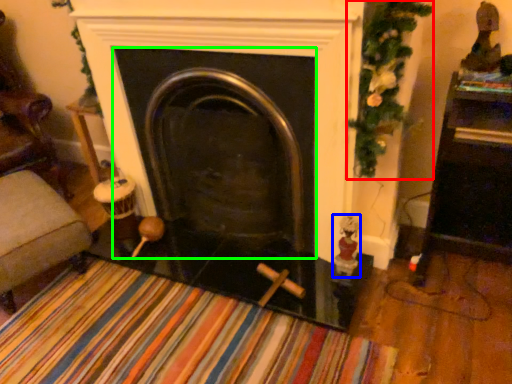
Question: Which object is positioned farthest from christmas decoration (highlighted by a red box)? Select from toy (highlighted by a blue box) and fireplace (highlighted by a green box).

Choices:
 (A) toy
 (B) fireplace

Answer: (A)